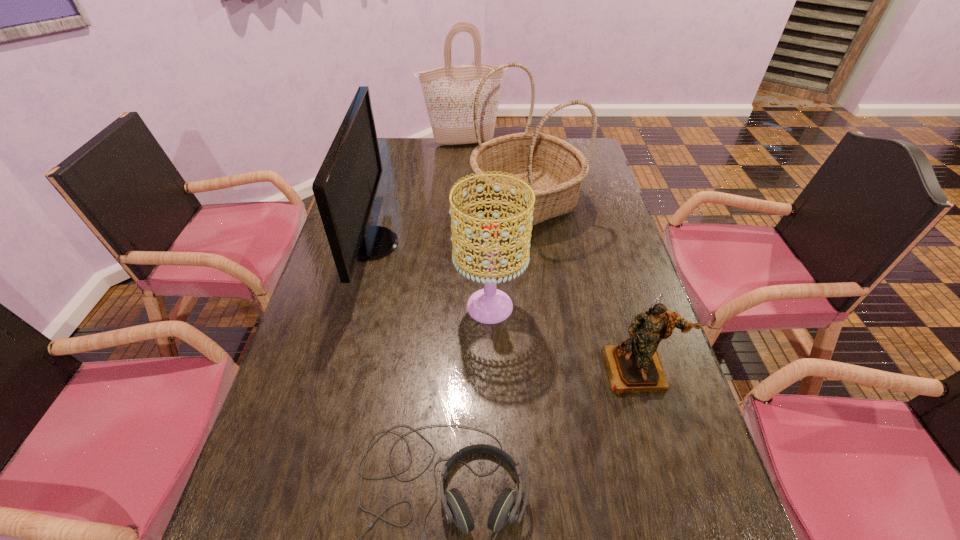
This screenshot has height=540, width=960. Identify the location of blank space located on the front-facing side of the fifth tallest object. pyautogui.click(x=684, y=531).

This screenshot has width=960, height=540. In order to click on object located at the far edge in this screenshot , I will do `click(449, 92)`.

In order to click on object present at the left edge in this screenshot , I will do `click(345, 187)`.

Locate an element on the screen. The height and width of the screenshot is (540, 960). basket that is at the right edge is located at coordinates (555, 169).

Identify the location of figurine present at the right edge. This screenshot has width=960, height=540. (634, 366).

This screenshot has width=960, height=540. In the image, there is a desktop. Identify the location of vacant space at the far edge. (438, 160).

Find the location of a particular element. The height and width of the screenshot is (540, 960). vacant space at the left edge of the desktop is located at coordinates (361, 262).

Find the location of a particular element. This screenshot has height=540, width=960. free space at the right edge of the desktop is located at coordinates (601, 235).

In the image, there is a desktop. Identify the location of free region at the far left corner. This screenshot has width=960, height=540. (382, 140).

Image resolution: width=960 pixels, height=540 pixels. What are the coordinates of `vacant space that is in between the computer monitor and the basket` in the screenshot? It's located at (448, 222).